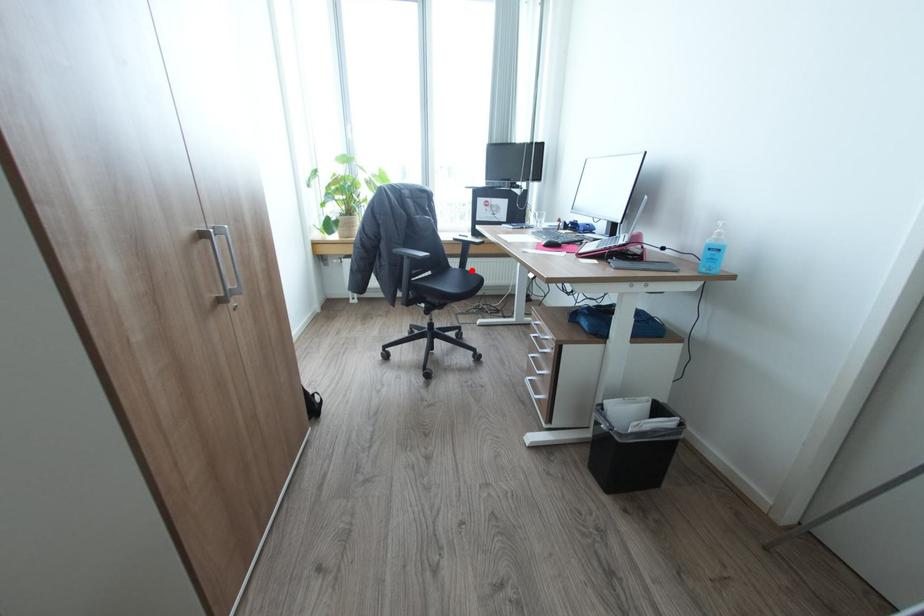
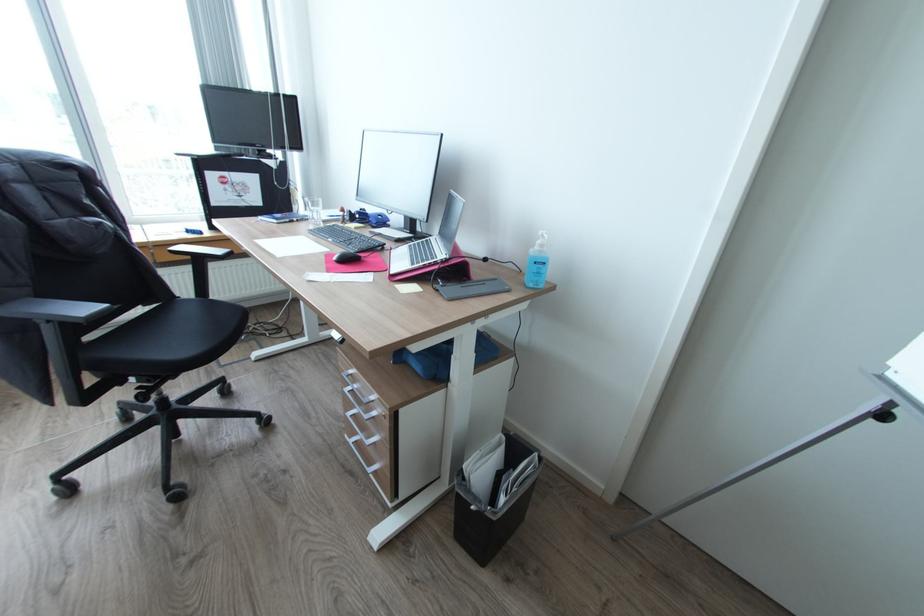
Question: I am providing you with two images of the same scene from different viewpoints. A red point is shown in image1. For the corresponding object point in image2, is it positioned nearer or farther from the camera?

Choices:
 (A) Nearer
 (B) Farther

Answer: (A)